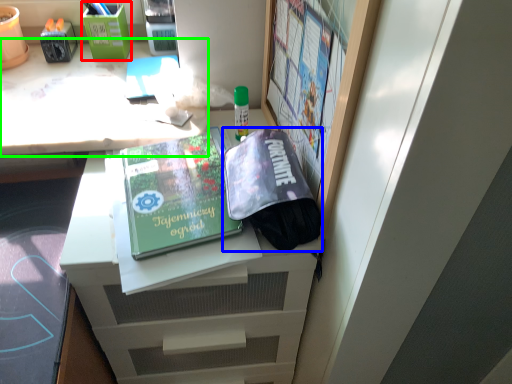
Question: Based on their relative distances, which object is farther from stationery (highlighted by a red box)? Choose from bag (highlighted by a blue box) and desk (highlighted by a green box).

Choices:
 (A) bag
 (B) desk

Answer: (A)